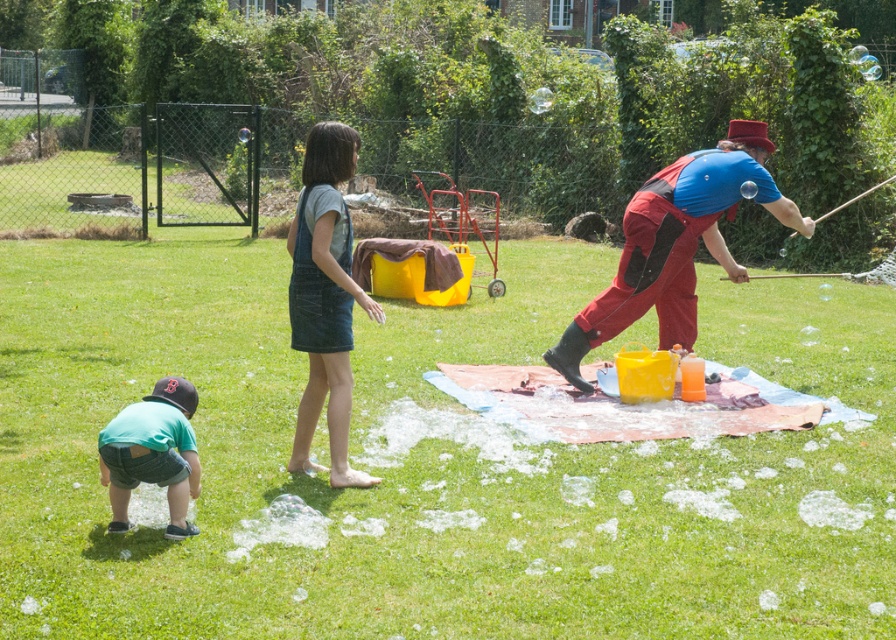
Can you confirm if matte red jumpsuit at right is positioned to the right of denim overalls at center?

Yes, matte red jumpsuit at right is to the right of denim overalls at center.

Locate an element on the screen. Image resolution: width=896 pixels, height=640 pixels. matte red jumpsuit at right is located at coordinates (675, 244).

Find the location of `matte red jumpsuit at right`. matte red jumpsuit at right is located at coordinates (675, 244).

Can you confirm if denim overalls at center is smaller than green denim shorts at lower left?

Incorrect, denim overalls at center is not smaller in size than green denim shorts at lower left.

Who is more forward, (291, 346) or (192, 456)?

Positioned in front is point (192, 456).

At what (x,y) coordinates should I click in order to perform the action: click on denim overalls at center. Please return your answer as a coordinate pair (x, y). The image size is (896, 640). Looking at the image, I should click on (325, 298).

Between matte red jumpsuit at right and green denim shorts at lower left, which one is positioned higher?

matte red jumpsuit at right is above.

Looking at this image, can you confirm if matte red jumpsuit at right is positioned above green denim shorts at lower left?

Yes, matte red jumpsuit at right is above green denim shorts at lower left.

Is point (619, 317) in front of point (135, 419)?

No, (619, 317) is further to viewer.

Where is `matte red jumpsuit at right`? matte red jumpsuit at right is located at coordinates (675, 244).